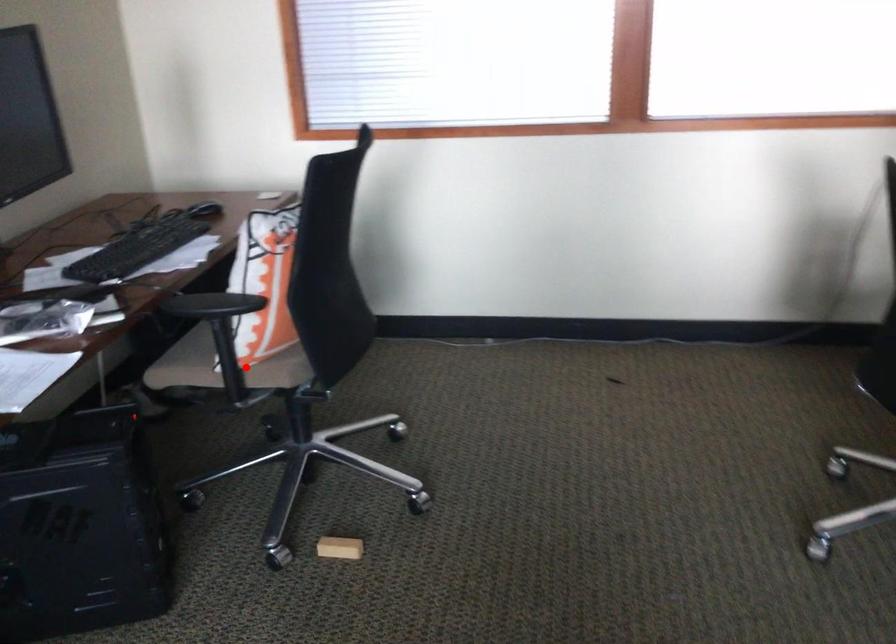
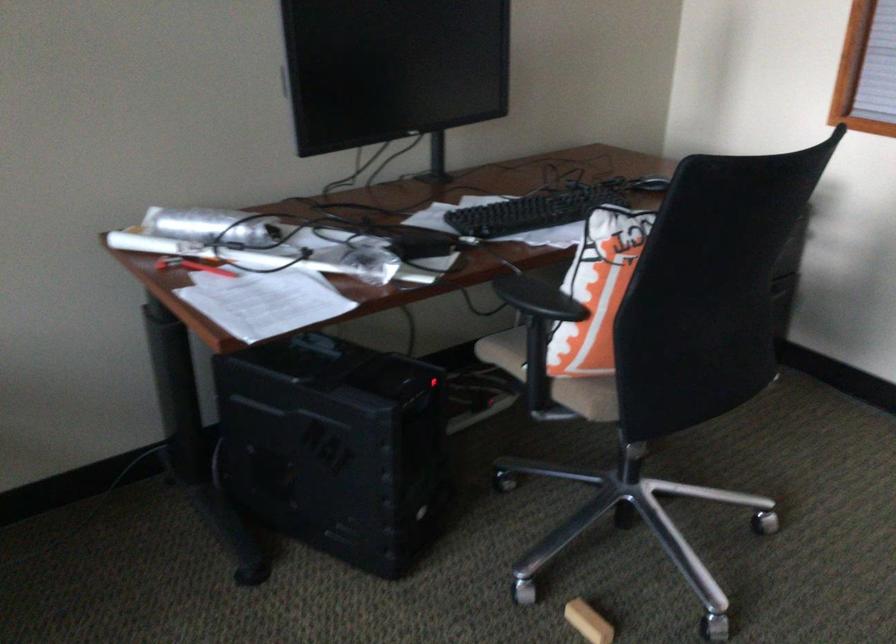
Locate, in the second image, the point that corresponds to the highlighted location in the first image.

(552, 377)